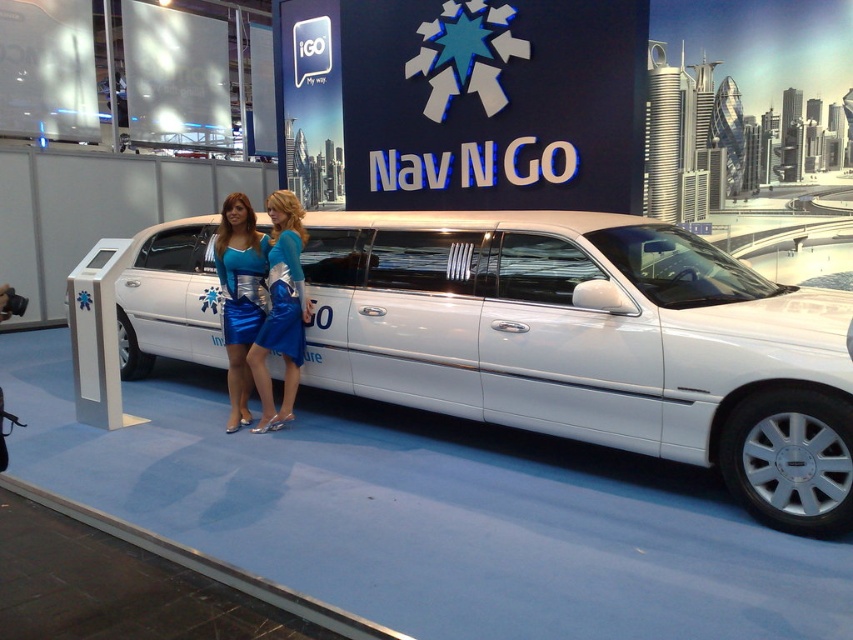
Which of these two, white metallic sedan at center or shiny blue dress at center, stands shorter?

shiny blue dress at center is shorter.

Which is below, white metallic sedan at center or shiny blue dress at center?

Positioned lower is shiny blue dress at center.

Locate an element on the screen. This screenshot has width=853, height=640. white metallic sedan at center is located at coordinates (593, 342).

Can you confirm if blue satin dress at center is shorter than shiny blue dress at center?

In fact, blue satin dress at center may be taller than shiny blue dress at center.

Which of these two, blue satin dress at center or shiny blue dress at center, stands taller?

blue satin dress at center is taller.

Find the location of a particular element. Image resolution: width=853 pixels, height=640 pixels. blue satin dress at center is located at coordinates (281, 308).

Find the location of a particular element. blue satin dress at center is located at coordinates (281, 308).

Between white metallic sedan at center and blue satin dress at center, which one is positioned lower?

Positioned lower is blue satin dress at center.

Is white metallic sedan at center positioned in front of blue satin dress at center?

Yes, white metallic sedan at center is in front of blue satin dress at center.

Which is behind, point (822, 320) or point (256, 346)?

The point (256, 346) is behind.

Identify the location of white metallic sedan at center. The image size is (853, 640). (593, 342).